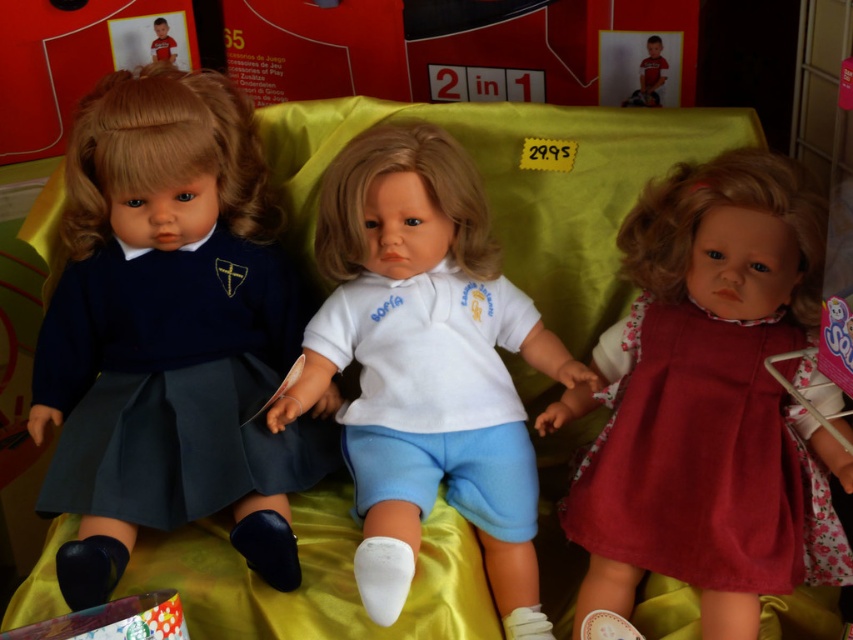
Question: In this image, where is matte red dress at center located relative to white cotton shirt at center?

Choices:
 (A) below
 (B) above

Answer: (B)

Question: Estimate the real-world distances between objects in this image. Which object is farther from the matte red dress at center?

Choices:
 (A) white cotton shirt at center
 (B) navy blue fabric dress at left

Answer: (B)

Question: Which object is positioned closest to the navy blue fabric dress at left?

Choices:
 (A) matte red dress at center
 (B) white cotton shirt at center
 (C) white matte shirt at center

Answer: (C)

Question: Does matte red dress at center have a greater width compared to white matte shirt at center?

Choices:
 (A) no
 (B) yes

Answer: (A)

Question: Which of the following is the farthest from the observer?

Choices:
 (A) (352, 234)
 (B) (279, 300)
 (C) (358, 433)

Answer: (B)

Question: Is the position of navy blue fabric dress at left more distant than that of matte red dress at center?

Choices:
 (A) yes
 (B) no

Answer: (A)